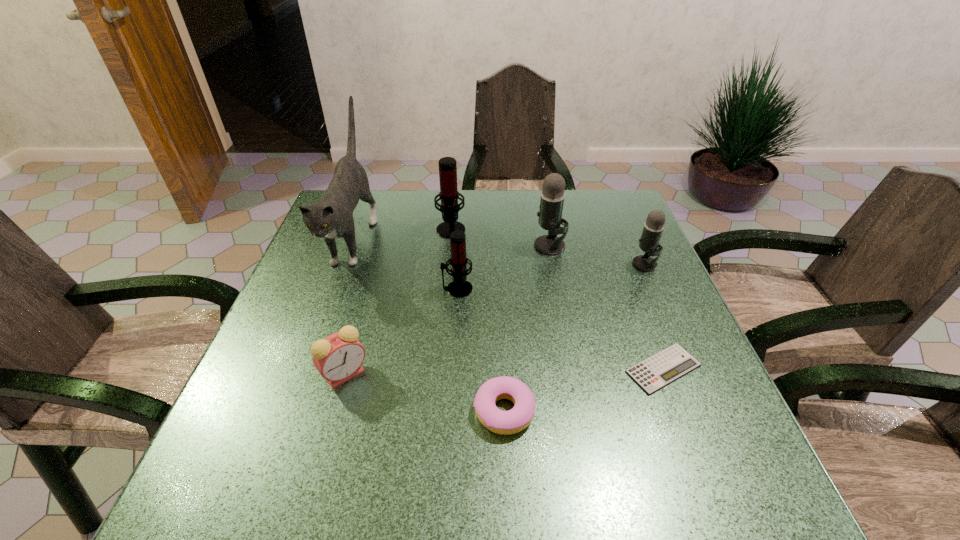
At what (x,y) coordinates should I click in order to perform the action: click on the second shortest object. Please return your answer as a coordinate pair (x, y). Looking at the image, I should click on (513, 421).

Locate an element on the screen. Image resolution: width=960 pixels, height=540 pixels. the fifth object from left to right is located at coordinates (x=513, y=421).

You are a GUI agent. You are given a task and a screenshot of the screen. Output one action in this format:
    pyautogui.click(x=<x>, y=<y>)
    Task: Click on the shortest object
    
    Given the screenshot: What is the action you would take?
    (652, 374)

Identify the location of vacant point located at the face of the cat. The height and width of the screenshot is (540, 960). (290, 409).

Find the location of a particular element. This screenshot has width=960, height=540. free space located on the front of the farther red microphone is located at coordinates (441, 347).

Where is `free spot located 0.320m on the front of the left gray microphone`? The image size is (960, 540). free spot located 0.320m on the front of the left gray microphone is located at coordinates (570, 351).

The height and width of the screenshot is (540, 960). Find the location of `free point located 0.260m on the back of the smaller gray microphone`. free point located 0.260m on the back of the smaller gray microphone is located at coordinates (618, 204).

Identify the location of vacant region located 0.060m on the back of the nearer red microphone. This screenshot has height=540, width=960. (459, 265).

The image size is (960, 540). Identify the location of vacant space located on the face of the sixth tallest object. (324, 451).

Where is `vacant space situated on the left of the doughnut`? vacant space situated on the left of the doughnut is located at coordinates 344,410.